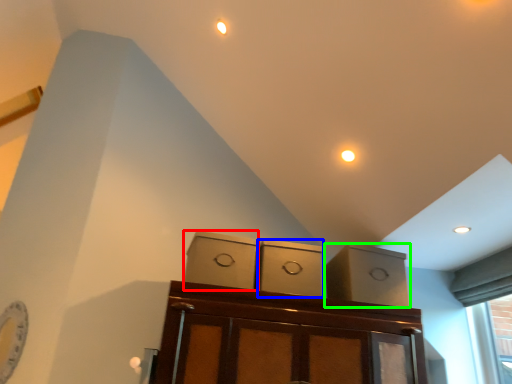
Question: Considering the real-world distances, which object is farthest from cabinetry (highlighted by a red box)? cabinetry (highlighted by a blue box) or cabinetry (highlighted by a green box)?

Choices:
 (A) cabinetry
 (B) cabinetry

Answer: (B)